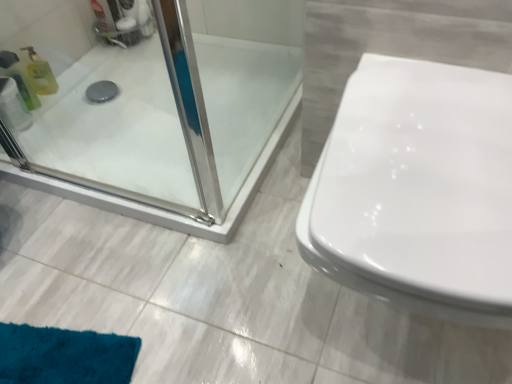
Describe the element at coordinates (418, 190) in the screenshot. Image resolution: width=512 pixels, height=384 pixels. I see `white glossy toilet at right` at that location.

In the scene shown: In order to face translucent yellow bottle at left, the first cleaning product positioned from the front, should I rotate leftwards or rightwards?

Turn left approximately 29.298 degrees to face it.

Describe the element at coordinates (13, 106) in the screenshot. I see `transparent plastic toilet paper at upper left` at that location.

The height and width of the screenshot is (384, 512). What are the coordinates of `translucent plastic bottle at left, which ranks as the first cleaning product in back-to-front order` in the screenshot? It's located at (40, 74).

Locate an element on the screen. white glossy toilet at right is located at coordinates (418, 190).

Locate an element on the screen. The width and height of the screenshot is (512, 384). the 2nd cleaning product above when counting from the white glossy toilet at right (from the image's perspective) is located at coordinates (40, 74).

Which object is positioned more to the right, translucent plastic bottle at left, the 2th cleaning product positioned from the front, or white glossy toilet at right?

white glossy toilet at right.

Based on the photo, is translucent plastic bottle at left, which ranks as the first cleaning product in back-to-front order, positioned with its back to white glossy toilet at right?

No, white glossy toilet at right is not at the back of translucent plastic bottle at left, which ranks as the first cleaning product in back-to-front order.

Is translucent plastic bottle at left, the 2th cleaning product positioned from the front, outside of white glossy toilet at right?

translucent plastic bottle at left, the 2th cleaning product positioned from the front, is positioned outside white glossy toilet at right.

Is transparent plastic toilet paper at upper left bigger than white glossy toilet at right?

No, transparent plastic toilet paper at upper left is not bigger than white glossy toilet at right.

From a real-world perspective, relative to white glossy toilet at right, is transparent plastic toilet paper at upper left vertically above or below?

transparent plastic toilet paper at upper left is situated lower than white glossy toilet at right in the real world.

Identify the location of toilet that appears in front of the transparent plastic toilet paper at upper left. The height and width of the screenshot is (384, 512). (418, 190).

Is transparent plastic toilet paper at upper left not within white glossy toilet at right?

That's correct, transparent plastic toilet paper at upper left is outside of white glossy toilet at right.

Based on the photo, in the image, is white glossy toilet at right on the left side or the right side of translucent plastic bottle at left, which ranks as the first cleaning product in back-to-front order?

In the image, white glossy toilet at right appears on the right side of translucent plastic bottle at left, which ranks as the first cleaning product in back-to-front order.

Does point (367, 177) lie in front of point (37, 77)?

Yes, point (367, 177) is closer to viewer.

Is white glossy toilet at right not inside translucent plastic bottle at left, which ranks as the first cleaning product in back-to-front order?

Yes, white glossy toilet at right is outside of translucent plastic bottle at left, which ranks as the first cleaning product in back-to-front order.

From their relative heights in the image, would you say translucent yellow bottle at left, the second cleaning product positioned from the back, is taller or shorter than white glossy toilet at right?

translucent yellow bottle at left, the second cleaning product positioned from the back, is shorter than white glossy toilet at right.

How different are the orientations of translucent yellow bottle at left, the first cleaning product positioned from the front, and white glossy toilet at right in degrees?

85.3 degrees.

From the image's perspective, which one is positioned lower, translucent yellow bottle at left, the first cleaning product positioned from the front, or white glossy toilet at right?

white glossy toilet at right appears lower in the image.

From the white glossy toilet at right, count 1st cleaning products backward and point to it. Please provide its 2D coordinates.

[(20, 79)]

Which of these two, translucent yellow bottle at left, the second cleaning product positioned from the back, or transparent plastic toilet paper at upper left, stands shorter?

transparent plastic toilet paper at upper left is shorter.

From a real-world perspective, is translucent yellow bottle at left, the first cleaning product positioned from the front, physically below transparent plastic toilet paper at upper left?

No, from a real-world perspective, translucent yellow bottle at left, the first cleaning product positioned from the front, is not beneath transparent plastic toilet paper at upper left.

Considering the relative positions of translucent yellow bottle at left, the first cleaning product positioned from the front, and transparent plastic toilet paper at upper left in the image provided, is translucent yellow bottle at left, the first cleaning product positioned from the front, to the right of transparent plastic toilet paper at upper left from the viewer's perspective?

Correct, you'll find translucent yellow bottle at left, the first cleaning product positioned from the front, to the right of transparent plastic toilet paper at upper left.

Is translucent yellow bottle at left, the first cleaning product positioned from the front, far from transparent plastic toilet paper at upper left?

No, there isn't a large distance between translucent yellow bottle at left, the first cleaning product positioned from the front, and transparent plastic toilet paper at upper left.

From a real-world perspective, between transparent plastic toilet paper at upper left and translucent plastic bottle at left, which ranks as the first cleaning product in back-to-front order, who is vertically higher?

translucent plastic bottle at left, which ranks as the first cleaning product in back-to-front order, is physically above.

Is transparent plastic toilet paper at upper left looking in the opposite direction of translucent plastic bottle at left, which ranks as the first cleaning product in back-to-front order?

No, transparent plastic toilet paper at upper left's orientation is not away from translucent plastic bottle at left, which ranks as the first cleaning product in back-to-front order.

Is there a large distance between transparent plastic toilet paper at upper left and translucent plastic bottle at left, which ranks as the first cleaning product in back-to-front order?

transparent plastic toilet paper at upper left is near translucent plastic bottle at left, which ranks as the first cleaning product in back-to-front order, not far away.

Looking at this image, from a real-world perspective, between translucent plastic bottle at left, the 2th cleaning product positioned from the front, and translucent yellow bottle at left, the second cleaning product positioned from the back, who is vertically lower?

From a 3D spatial view, translucent plastic bottle at left, the 2th cleaning product positioned from the front, is below.

Is translucent plastic bottle at left, the 2th cleaning product positioned from the front, at the right side of translucent yellow bottle at left, the second cleaning product positioned from the back?

Indeed, translucent plastic bottle at left, the 2th cleaning product positioned from the front, is positioned on the right side of translucent yellow bottle at left, the second cleaning product positioned from the back.

From the image's perspective, is translucent plastic bottle at left, which ranks as the first cleaning product in back-to-front order, positioned above or below translucent yellow bottle at left, the second cleaning product positioned from the back?

translucent plastic bottle at left, which ranks as the first cleaning product in back-to-front order, is above translucent yellow bottle at left, the second cleaning product positioned from the back.

Can you see translucent plastic bottle at left, which ranks as the first cleaning product in back-to-front order, touching translucent yellow bottle at left, the second cleaning product positioned from the back?

Indeed, translucent plastic bottle at left, which ranks as the first cleaning product in back-to-front order, and translucent yellow bottle at left, the second cleaning product positioned from the back, are beside each other and touching.

I want to click on the 1st cleaning product counting from the left side of the white glossy toilet at right, so click(40, 74).

Where is `toilet below the transparent plastic toilet paper at upper left (from the image's perspective)`? This screenshot has height=384, width=512. toilet below the transparent plastic toilet paper at upper left (from the image's perspective) is located at coordinates (418, 190).

Based on their spatial positions, is white glossy toilet at right or transparent plastic toilet paper at upper left closer to translucent yellow bottle at left, the first cleaning product positioned from the front?

transparent plastic toilet paper at upper left is positioned closer to the anchor translucent yellow bottle at left, the first cleaning product positioned from the front.

From the image, which object appears to be nearer to transparent plastic toilet paper at upper left, translucent yellow bottle at left, the first cleaning product positioned from the front, or translucent plastic bottle at left, the 2th cleaning product positioned from the front?

translucent yellow bottle at left, the first cleaning product positioned from the front.

From the image, which object appears to be nearer to translucent yellow bottle at left, the first cleaning product positioned from the front, transparent plastic toilet paper at upper left or white glossy toilet at right?

transparent plastic toilet paper at upper left is closer to translucent yellow bottle at left, the first cleaning product positioned from the front.

Considering their positions, is translucent plastic bottle at left, the 2th cleaning product positioned from the front, positioned closer to white glossy toilet at right than translucent yellow bottle at left, the first cleaning product positioned from the front?

translucent yellow bottle at left, the first cleaning product positioned from the front.

In the scene shown: Estimate the real-world distances between objects in this image. Which object is closer to translucent yellow bottle at left, the second cleaning product positioned from the back, translucent plastic bottle at left, the 2th cleaning product positioned from the front, or transparent plastic toilet paper at upper left?

Among the two, translucent plastic bottle at left, the 2th cleaning product positioned from the front, is located nearer to translucent yellow bottle at left, the second cleaning product positioned from the back.

Based on their spatial positions, is transparent plastic toilet paper at upper left or translucent plastic bottle at left, the 2th cleaning product positioned from the front, closer to white glossy toilet at right?

translucent plastic bottle at left, the 2th cleaning product positioned from the front, is closer to white glossy toilet at right.

Based on their spatial positions, is translucent plastic bottle at left, which ranks as the first cleaning product in back-to-front order, or white glossy toilet at right closer to transparent plastic toilet paper at upper left?

translucent plastic bottle at left, which ranks as the first cleaning product in back-to-front order.

Estimate the real-world distances between objects in this image. Which object is further from translucent yellow bottle at left, the first cleaning product positioned from the front, translucent plastic bottle at left, which ranks as the first cleaning product in back-to-front order, or white glossy toilet at right?

white glossy toilet at right lies further to translucent yellow bottle at left, the first cleaning product positioned from the front, than the other object.

At what (x,y) coordinates should I click in order to perform the action: click on cleaning product between translucent plastic bottle at left, which ranks as the first cleaning product in back-to-front order, and transparent plastic toilet paper at upper left from top to bottom. Please return your answer as a coordinate pair (x, y). This screenshot has height=384, width=512. Looking at the image, I should click on (20, 79).

Where is `cleaning product located between translucent yellow bottle at left, the first cleaning product positioned from the front, and white glossy toilet at right in the left-right direction`? The height and width of the screenshot is (384, 512). cleaning product located between translucent yellow bottle at left, the first cleaning product positioned from the front, and white glossy toilet at right in the left-right direction is located at coordinates (40, 74).